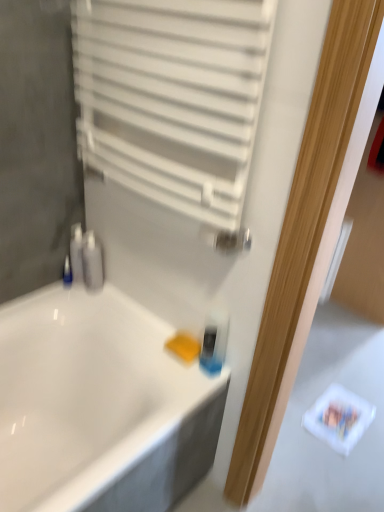
Locate an element on the screen. The image size is (384, 512). free location in front of blue plastic bottle at left, which is the first toiletry in left-to-right order is located at coordinates (56, 298).